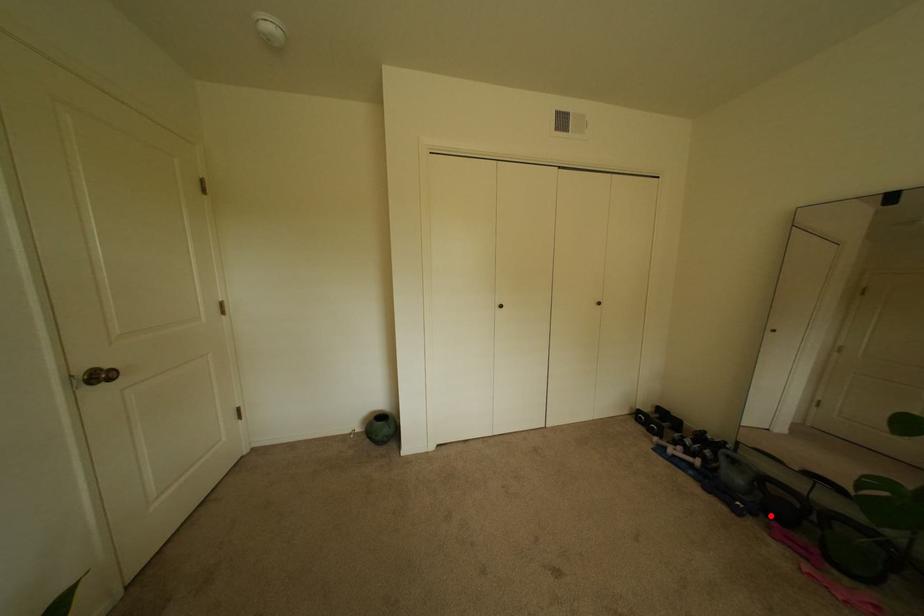
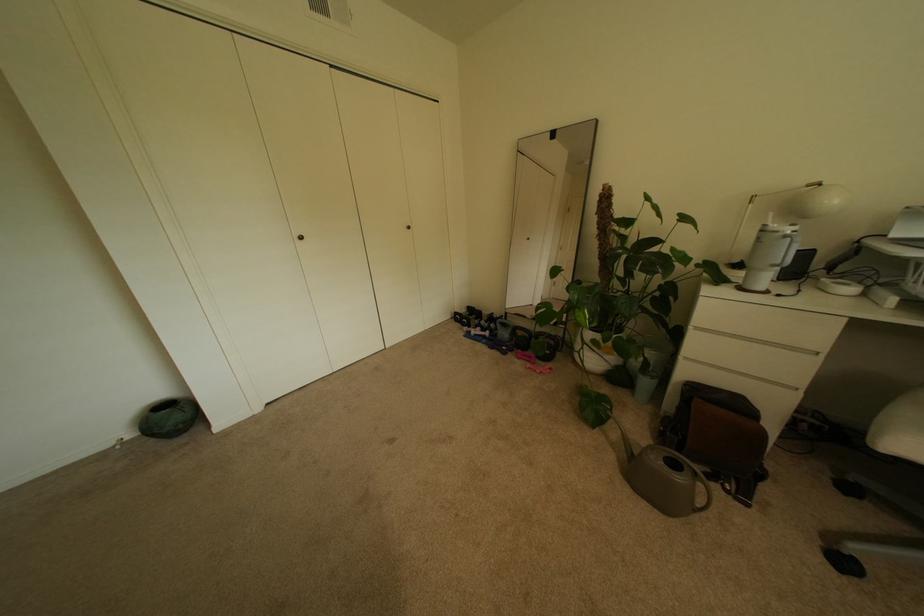
In the second image, find the point that corresponds to the highlighted location in the first image.

(524, 350)